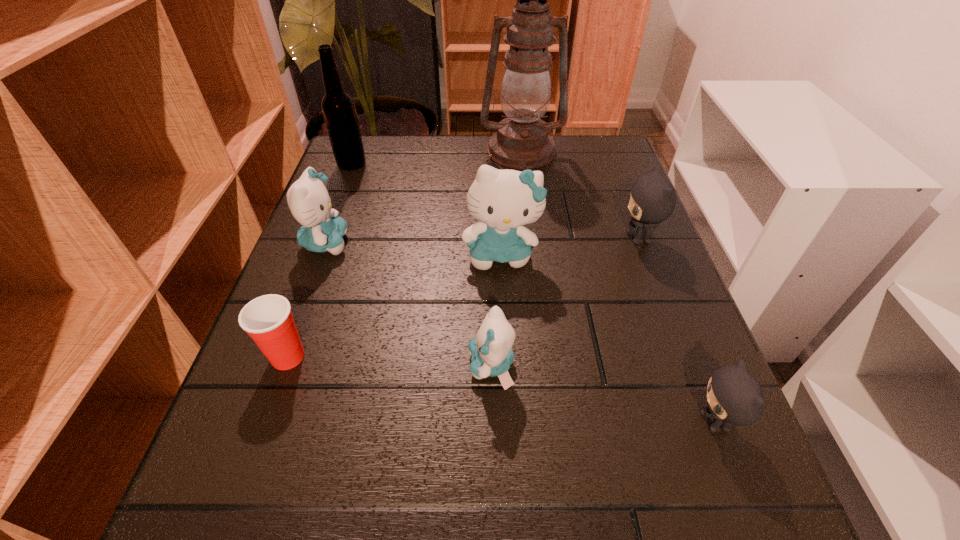
You are a GUI agent. You are given a task and a screenshot of the screen. Output one action in this format:
    pyautogui.click(x=<x>, y=<y>)
    Task: Click on the object at the far left corner
    Image resolution: width=960 pixels, height=540 pixels.
    Given the screenshot: What is the action you would take?
    pyautogui.click(x=338, y=107)

Locate an element on the screen. This screenshot has height=540, width=960. object that is positioned at the far right corner is located at coordinates (522, 142).

The width and height of the screenshot is (960, 540). In the image, there is a desktop. What are the coordinates of `vacant region at the far edge` in the screenshot? It's located at (543, 185).

This screenshot has width=960, height=540. I want to click on vacant position at the left edge of the desktop, so click(376, 255).

The width and height of the screenshot is (960, 540). I want to click on blank space at the right edge of the desktop, so click(x=670, y=281).

Find the location of a particular element. This screenshot has width=960, height=540. vacant space at the far left corner is located at coordinates (351, 184).

This screenshot has height=540, width=960. In order to click on free region at the near left corner in this screenshot , I will do `click(224, 531)`.

The height and width of the screenshot is (540, 960). Find the location of `free space at the far right corner of the desktop`. free space at the far right corner of the desktop is located at coordinates (607, 136).

Locate an element on the screen. The image size is (960, 540). vacant space at the near right corner of the desktop is located at coordinates (757, 489).

This screenshot has width=960, height=540. I want to click on free spot between the Dixie cup and the third tallest object, so click(395, 305).